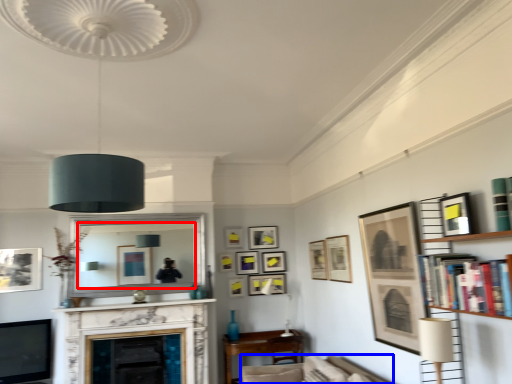
Question: Among these objects, which one is nearest to the camera, mirror (highlighted by a red box) or swivel chair (highlighted by a blue box)?

Choices:
 (A) mirror
 (B) swivel chair

Answer: (B)